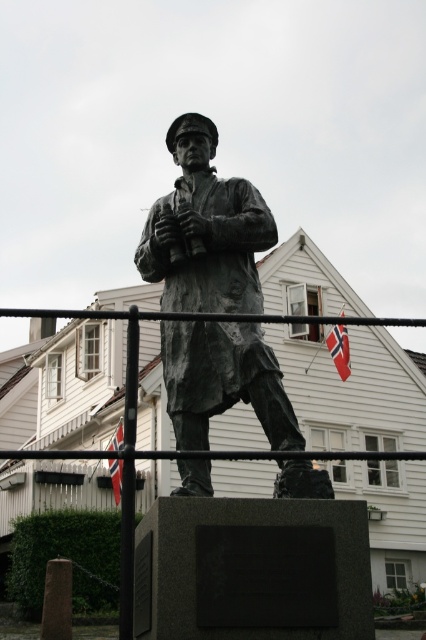
Question: Which object is positioned farthest from the red fabric flag at center?

Choices:
 (A) white fabric flag at upper center
 (B) bronze statue at center

Answer: (A)

Question: Is white fabric flag at upper center bigger than red fabric flag at center?

Choices:
 (A) no
 (B) yes

Answer: (A)

Question: In this image, where is bronze statue at center located relative to white fabric flag at upper center?

Choices:
 (A) right
 (B) left

Answer: (B)

Question: Is bronze statue at center wider than white fabric flag at upper center?

Choices:
 (A) no
 (B) yes

Answer: (B)

Question: Which point is closer to the camera?

Choices:
 (A) red fabric flag at center
 (B) bronze statue at center

Answer: (A)

Question: Based on their relative distances, which object is farther from the white fabric flag at upper center?

Choices:
 (A) red fabric flag at center
 (B) bronze statue at center

Answer: (B)